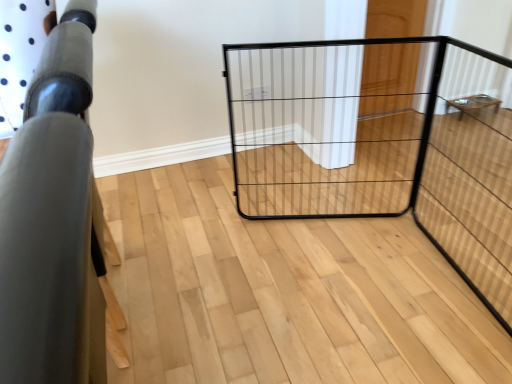
Question: Would you consider wooden table at right, marked as the first furniture in a right-to-left arrangement, to be distant from black wire cage at center?

Choices:
 (A) yes
 (B) no

Answer: (B)

Question: Could you tell me if wooden table at right, positioned as the second furniture in front-to-back order, is facing black wire cage at center?

Choices:
 (A) yes
 (B) no

Answer: (B)

Question: Considering the relative sizes of wooden table at right, the first furniture in the top-to-bottom sequence, and black wire cage at center in the image provided, is wooden table at right, the first furniture in the top-to-bottom sequence, bigger than black wire cage at center?

Choices:
 (A) no
 (B) yes

Answer: (A)

Question: Is wooden table at right, marked as the first furniture in a right-to-left arrangement, positioned before black wire cage at center?

Choices:
 (A) no
 (B) yes

Answer: (A)

Question: Considering the relative positions of wooden table at right, the first furniture in the top-to-bottom sequence, and black wire cage at center in the image provided, is wooden table at right, the first furniture in the top-to-bottom sequence, to the right of black wire cage at center from the viewer's perspective?

Choices:
 (A) no
 (B) yes

Answer: (B)

Question: From a real-world perspective, is matte black railing at left, which appears as the second furniture when viewed from the top, physically located above or below wooden door at upper right?

Choices:
 (A) below
 (B) above

Answer: (B)

Question: Is matte black railing at left, which ranks as the first furniture in left-to-right order, wider or thinner than wooden door at upper right?

Choices:
 (A) thin
 (B) wide

Answer: (B)

Question: Is point (52, 152) positioned closer to the camera than point (370, 16)?

Choices:
 (A) closer
 (B) farther

Answer: (A)

Question: Visually, is matte black railing at left, which appears as the second furniture when viewed from the top, positioned to the left or to the right of wooden door at upper right?

Choices:
 (A) right
 (B) left

Answer: (B)

Question: Is black wire cage at center bigger or smaller than wooden table at right, positioned as the 1th furniture in back-to-front order?

Choices:
 (A) big
 (B) small

Answer: (A)

Question: Considering the relative positions of black wire cage at center and wooden table at right, positioned as the second furniture in front-to-back order, in the image provided, is black wire cage at center to the left or to the right of wooden table at right, positioned as the second furniture in front-to-back order,?

Choices:
 (A) left
 (B) right

Answer: (A)

Question: In the image, is black wire cage at center positioned in front of or behind wooden table at right, marked as the first furniture in a right-to-left arrangement?

Choices:
 (A) behind
 (B) front

Answer: (B)

Question: Looking at their shapes, would you say black wire cage at center is wider or thinner than wooden table at right, the second furniture positioned from the bottom?

Choices:
 (A) wide
 (B) thin

Answer: (B)

Question: From the image's perspective, is wooden door at upper right above or below black wire cage at center?

Choices:
 (A) above
 (B) below

Answer: (A)

Question: Relative to black wire cage at center, is wooden door at upper right in front or behind?

Choices:
 (A) front
 (B) behind

Answer: (B)